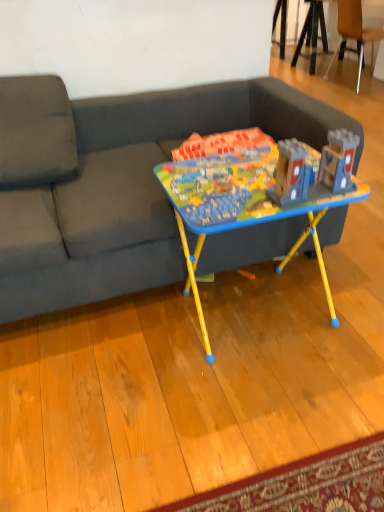
Question: From a real-world perspective, does matte plastic table at center stand above wooden at upper right?

Choices:
 (A) yes
 (B) no

Answer: (B)

Question: Can you confirm if matte plastic table at center is wider than wooden at upper right?

Choices:
 (A) no
 (B) yes

Answer: (A)

Question: From a real-world perspective, is matte plastic table at center positioned under wooden at upper right based on gravity?

Choices:
 (A) no
 (B) yes

Answer: (B)

Question: From the image's perspective, would you say matte plastic table at center is positioned over wooden at upper right?

Choices:
 (A) yes
 (B) no

Answer: (B)

Question: Can you confirm if matte plastic table at center is positioned to the right of wooden at upper right?

Choices:
 (A) yes
 (B) no

Answer: (B)

Question: Is matte plastic table at center closer to camera compared to wooden at upper right?

Choices:
 (A) yes
 (B) no

Answer: (A)

Question: From a real-world perspective, is dark gray fabric couch at center on matte plastic table at center?

Choices:
 (A) yes
 (B) no

Answer: (A)

Question: From a real-world perspective, is dark gray fabric couch at center physically below matte plastic table at center?

Choices:
 (A) no
 (B) yes

Answer: (A)

Question: Does dark gray fabric couch at center appear on the left side of matte plastic table at center?

Choices:
 (A) yes
 (B) no

Answer: (A)

Question: Is dark gray fabric couch at center thinner than matte plastic table at center?

Choices:
 (A) no
 (B) yes

Answer: (A)

Question: Is dark gray fabric couch at center outside matte plastic table at center?

Choices:
 (A) no
 (B) yes

Answer: (B)

Question: Can you confirm if dark gray fabric couch at center is positioned to the right of matte plastic table at center?

Choices:
 (A) no
 (B) yes

Answer: (A)

Question: Considering the relative positions of wooden at upper right and dark gray fabric couch at center in the image provided, is wooden at upper right to the left of dark gray fabric couch at center from the viewer's perspective?

Choices:
 (A) no
 (B) yes

Answer: (A)